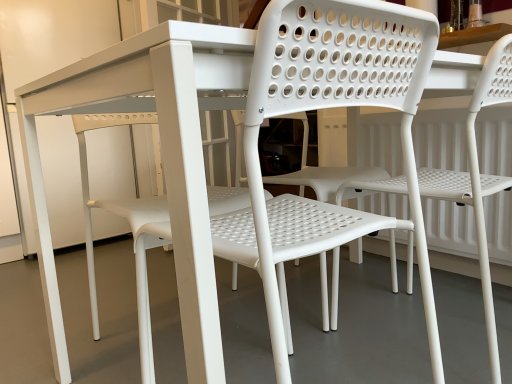
The width and height of the screenshot is (512, 384). Describe the element at coordinates (314, 242) in the screenshot. I see `white plastic chair at center` at that location.

Find the location of a particular element. The height and width of the screenshot is (384, 512). white plastic chair at center, the second chair from the left is located at coordinates (478, 176).

Does white plastic chair at center, the 1th chair positioned from the right, appear on the left side of white plastic chair at center?

No, white plastic chair at center, the 1th chair positioned from the right, is not to the left of white plastic chair at center.

Which object is further away from the camera, white plastic chair at center, the 1th chair positioned from the right, or white plastic chair at center?

Positioned behind is white plastic chair at center, the 1th chair positioned from the right.

Considering the sizes of objects white plastic chair at center, the 1th chair positioned from the right, and white plastic chair at center in the image provided, who is wider, white plastic chair at center, the 1th chair positioned from the right, or white plastic chair at center?

Wider between the two is white plastic chair at center.

Between white plastic chair at center, the second chair from the left, and white plastic chair at center, which is counted as the second chair, starting from the right, which one has larger size?

Bigger between the two is white plastic chair at center, the second chair from the left.

Can you see white plastic chair at center, the 1th chair positioned from the right, touching white plastic chair at center, the 1th chair when ordered from left to right?

No, white plastic chair at center, the 1th chair positioned from the right, is not with white plastic chair at center, the 1th chair when ordered from left to right.

Is white plastic chair at center, the 1th chair positioned from the right, turned away from white plastic chair at center, which is counted as the second chair, starting from the right?

That's not correct — white plastic chair at center, the 1th chair positioned from the right, is not looking away from white plastic chair at center, which is counted as the second chair, starting from the right.

Which of these two, white plastic chair at center, the second chair from the left, or white plastic chair at center, the 1th chair when ordered from left to right, stands shorter?

white plastic chair at center, the 1th chair when ordered from left to right.

How distant is white plastic chair at center from white plastic chair at center, the second chair from the left?

white plastic chair at center and white plastic chair at center, the second chair from the left, are 15.06 inches apart from each other.

Is white plastic chair at center touching white plastic chair at center, the second chair from the left?

No, white plastic chair at center is not next to white plastic chair at center, the second chair from the left.

Consider the image. Is white plastic chair at center, the second chair from the left, completely or partially inside white plastic chair at center?

Actually, white plastic chair at center, the second chair from the left, is outside white plastic chair at center.

Is white plastic chair at center looking in the opposite direction of white plastic chair at center, the second chair from the left?

No, white plastic chair at center, the second chair from the left, is not at the back of white plastic chair at center.

Who is more distant, white plastic chair at center, the 1th chair when ordered from left to right, or white plastic chair at center, the 1th chair positioned from the right?

white plastic chair at center, the 1th chair positioned from the right.

Is point (429, 40) closer to camera compared to point (440, 180)?

Yes.

At what (x,y) coordinates should I click in order to perform the action: click on chair that is behind the white plastic chair at center, which is counted as the second chair, starting from the right. Please return your answer as a coordinate pair (x, y). Looking at the image, I should click on (478, 176).

Choose the correct answer: Is white plastic chair at center, which is counted as the second chair, starting from the right, inside white plastic chair at center, the 1th chair positioned from the right, or outside it?

white plastic chair at center, which is counted as the second chair, starting from the right, is outside white plastic chair at center, the 1th chair positioned from the right.

From a real-world perspective, is white plastic chair at center below white plastic chair at center, the 1th chair when ordered from left to right?

Correct, in the physical world, white plastic chair at center is lower than white plastic chair at center, the 1th chair when ordered from left to right.

From the image's perspective, who appears lower, white plastic chair at center or white plastic chair at center, the 1th chair when ordered from left to right?

white plastic chair at center.

Can you see white plastic chair at center touching white plastic chair at center, the 1th chair when ordered from left to right?

Absolutely, white plastic chair at center is next to and touching white plastic chair at center, the 1th chair when ordered from left to right.

Does white plastic chair at center, which is counted as the second chair, starting from the right, turn towards white plastic chair at center?

Yes, white plastic chair at center, which is counted as the second chair, starting from the right, is aimed at white plastic chair at center.

Consider the image. Is white plastic chair at center, which is counted as the second chair, starting from the right, completely or partially outside of white plastic chair at center?

That's correct, white plastic chair at center, which is counted as the second chair, starting from the right, is outside of white plastic chair at center.

Which is more to the left, white plastic chair at center, which is counted as the second chair, starting from the right, or white plastic chair at center?

From the viewer's perspective, white plastic chair at center appears more on the left side.

Which is in front, point (416, 187) or point (338, 222)?

The point (338, 222) is closer to the camera.

In the image, there is a white plastic chair at center, the 1th chair positioned from the right. At what (x,y) coordinates should I click in order to perform the action: click on bar stool below it (from the image's perspective). Please return your answer as a coordinate pair (x, y). The height and width of the screenshot is (384, 512). Looking at the image, I should click on (314, 242).

Locate an element on the screen. This screenshot has width=512, height=384. chair behind the white plastic chair at center, the 1th chair when ordered from left to right is located at coordinates (478, 176).

Estimate the real-world distances between objects in this image. Which object is closer to white plastic chair at center, the 1th chair when ordered from left to right, white plastic chair at center, the second chair from the left, or white plastic chair at center?

white plastic chair at center is closer to white plastic chair at center, the 1th chair when ordered from left to right.

In the scene shown: Estimate the real-world distances between objects in this image. Which object is closer to white plastic chair at center, white plastic chair at center, which is counted as the second chair, starting from the right, or white plastic chair at center, the second chair from the left?

The object closer to white plastic chair at center is white plastic chair at center, which is counted as the second chair, starting from the right.

From the image, which object appears to be nearer to white plastic chair at center, white plastic chair at center, the 1th chair positioned from the right, or white plastic chair at center, which is counted as the second chair, starting from the right?

Among the two, white plastic chair at center, which is counted as the second chair, starting from the right, is located nearer to white plastic chair at center.

From the image, which object appears to be nearer to white plastic chair at center, the 1th chair positioned from the right, white plastic chair at center, the 1th chair when ordered from left to right, or white plastic chair at center?

white plastic chair at center, the 1th chair when ordered from left to right, is positioned closer to the anchor white plastic chair at center, the 1th chair positioned from the right.

Considering their positions, is white plastic chair at center positioned further to white plastic chair at center, which is counted as the second chair, starting from the right, than white plastic chair at center, the second chair from the left?

white plastic chair at center, the second chair from the left.

Considering their positions, is white plastic chair at center positioned closer to white plastic chair at center, the 1th chair positioned from the right, than white plastic chair at center, the 1th chair when ordered from left to right?

The object closer to white plastic chair at center, the 1th chair positioned from the right, is white plastic chair at center, the 1th chair when ordered from left to right.

The image size is (512, 384). I want to click on chair situated between white plastic chair at center and white plastic chair at center, the second chair from the left, from left to right, so click(x=327, y=107).